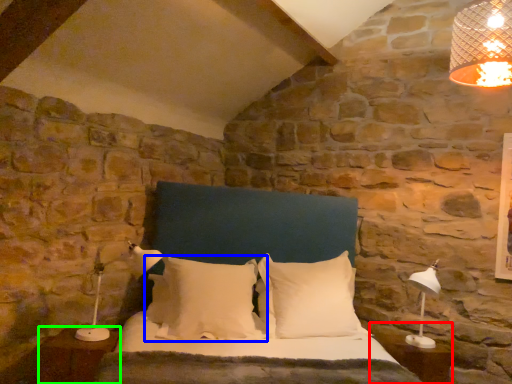
Question: Estimate the real-world distances between objects in this image. Which object is farther from side table (highlighted by a red box), pillow (highlighted by a blue box) or nightstand (highlighted by a green box)?

Choices:
 (A) pillow
 (B) nightstand

Answer: (B)